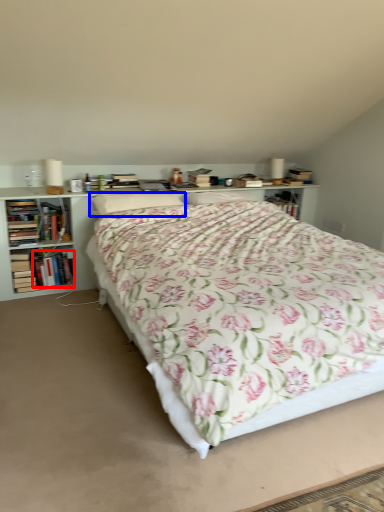
Question: Which object appears closest to the camera in this image, book (highlighted by a red box) or pillow (highlighted by a blue box)?

Choices:
 (A) book
 (B) pillow

Answer: (B)